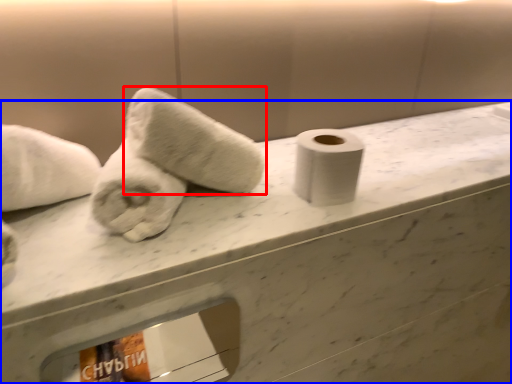
Question: Which point is closer to the camera, towel (highlighted by a red box) or counter (highlighted by a blue box)?

Choices:
 (A) towel
 (B) counter

Answer: (B)